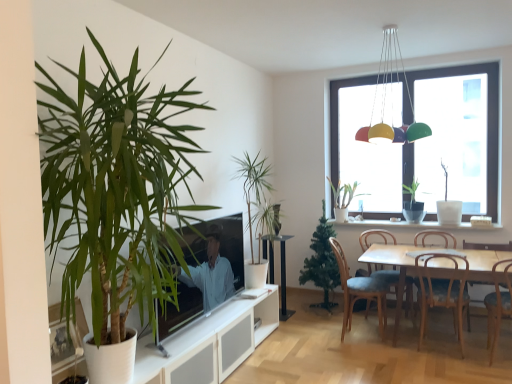
Find the location of a particular element. The image size is (512, 384). vacant area situated below white matte vase at right, which is the sixth houseplant from left to right (from a real-world perspective) is located at coordinates (450, 224).